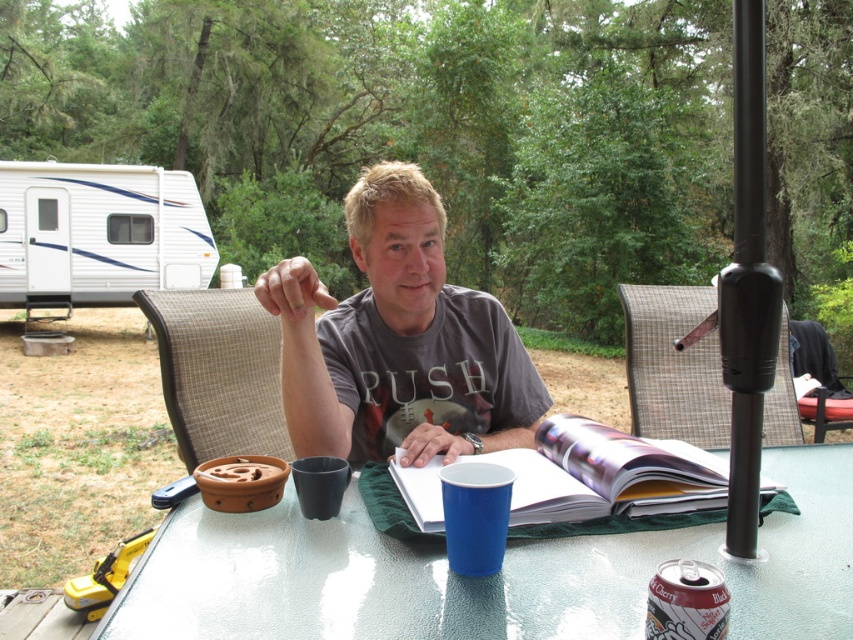
Question: Estimate the real-world distances between objects in this image. Which object is farther from the white plastic recreational vehicle at left?

Choices:
 (A) gray cotton shirt at center
 (B) matte paper book at center

Answer: (B)

Question: Which point is farther from the camera taking this photo?

Choices:
 (A) (154, 236)
 (B) (555, 444)
 (C) (656, 572)

Answer: (A)

Question: Does gray cotton shirt at center appear on the right side of white plastic recreational vehicle at left?

Choices:
 (A) yes
 (B) no

Answer: (A)

Question: Is white plastic recreational vehicle at left to the right of dull red can at lower right from the viewer's perspective?

Choices:
 (A) no
 (B) yes

Answer: (A)

Question: Which object is the closest to the white plastic recreational vehicle at left?

Choices:
 (A) gray cotton shirt at center
 (B) blue plastic cup at lower center

Answer: (A)

Question: Considering the relative positions of gray cotton shirt at center and dull red can at lower right in the image provided, where is gray cotton shirt at center located with respect to dull red can at lower right?

Choices:
 (A) above
 (B) below

Answer: (A)